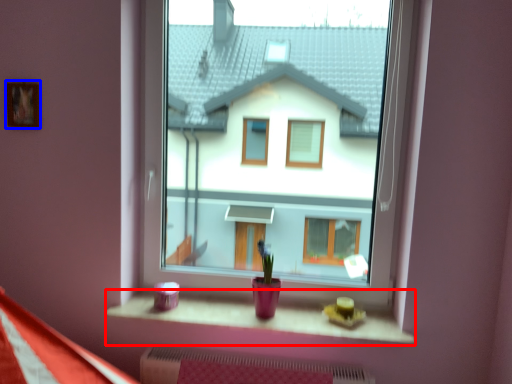
Question: Which of the following is the closest to the observer, window sill (highlighted by a red box) or picture frame (highlighted by a blue box)?

Choices:
 (A) window sill
 (B) picture frame

Answer: (A)